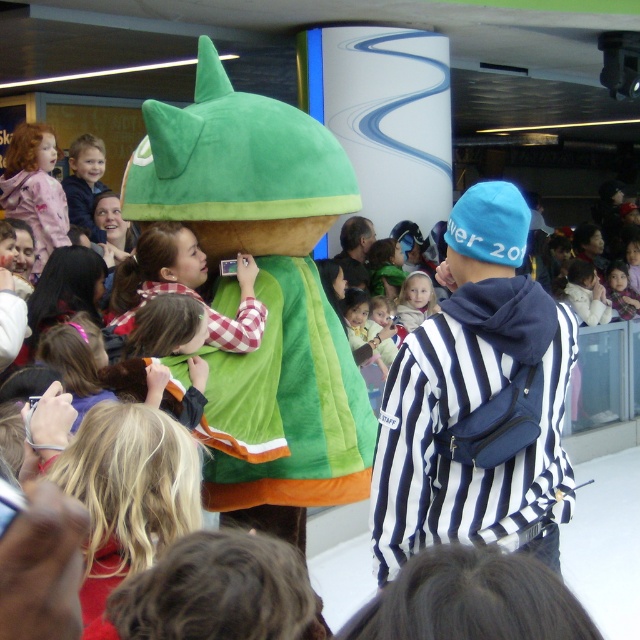
The image size is (640, 640). Identify the location of blue fleece beanie at upper right. (477, 401).

Based on the photo, is blue fleece beanie at upper right above smooth beige shirt at center?

Actually, blue fleece beanie at upper right is below smooth beige shirt at center.

Is point (525, 541) closer to camera compared to point (406, 280)?

That is True.

The image size is (640, 640). What are the coordinates of `blue fleece beanie at upper right` in the screenshot? It's located at (477, 401).